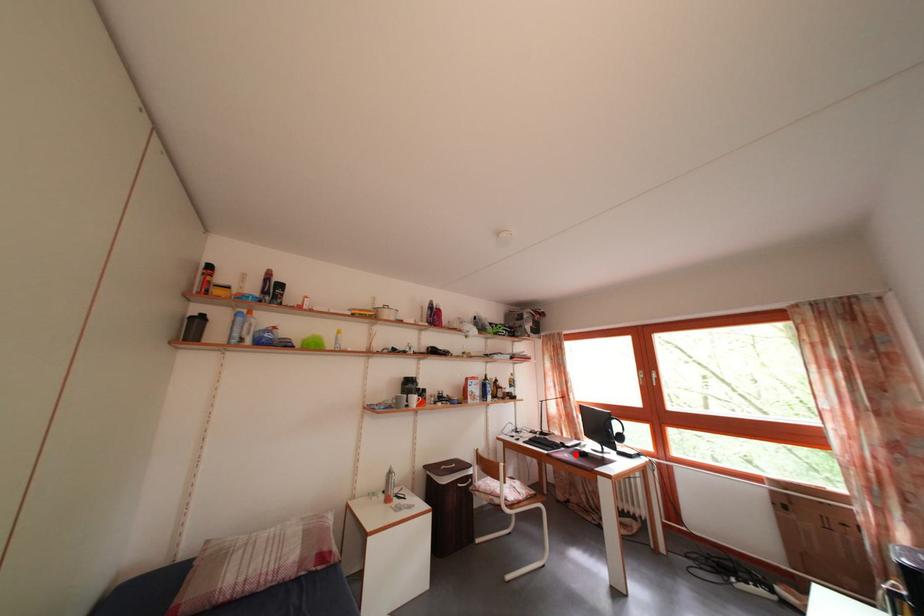
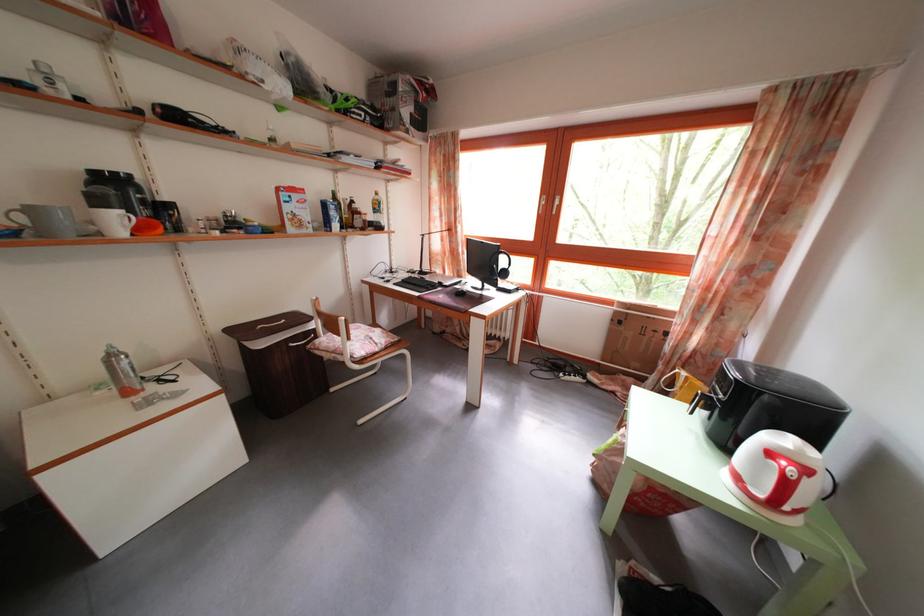
Question: I am providing you with two images of the same scene from different viewpoints. In image1, a red point is highlighted. Considering the same 3D point in image2, which of the following is correct?

Choices:
 (A) It is closer
 (B) It is farther

Answer: (A)